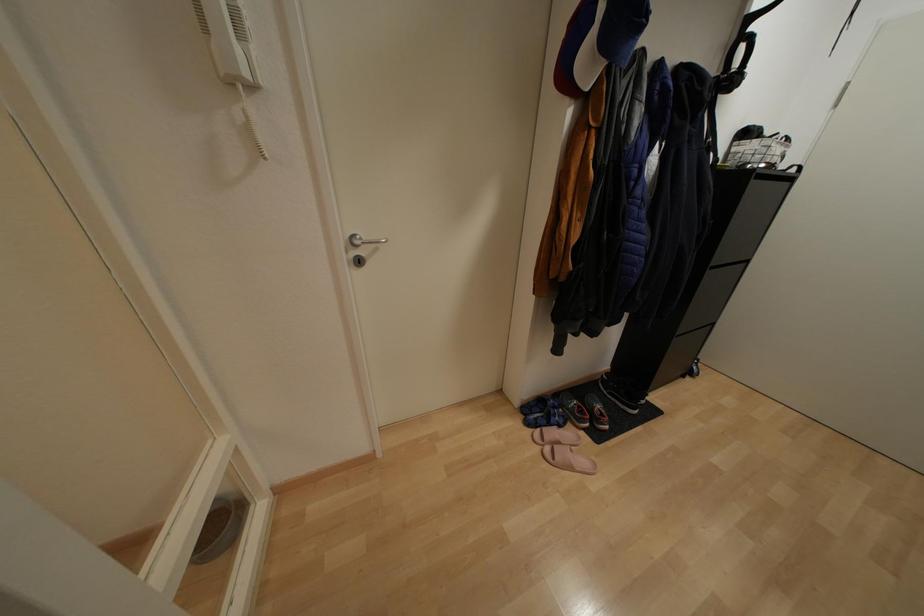
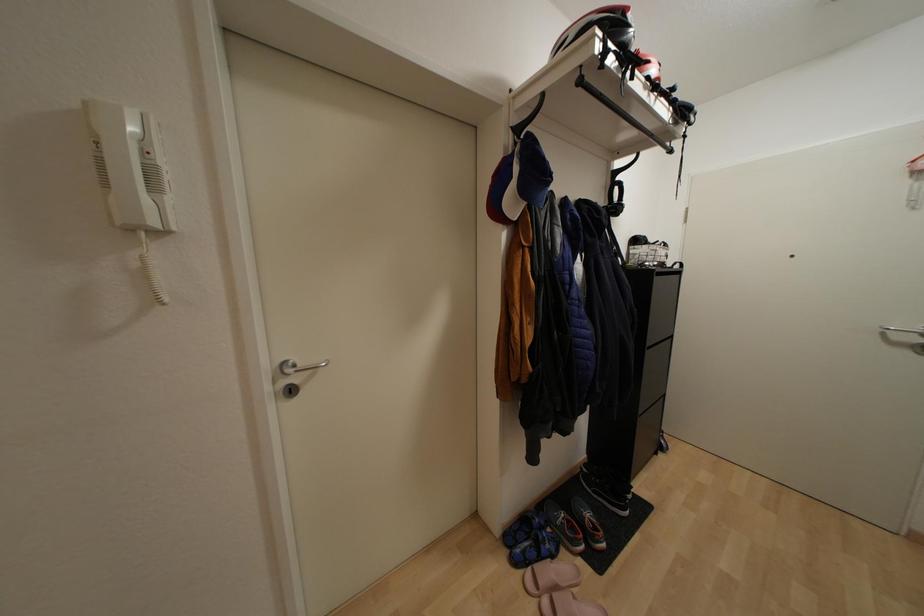
Question: What movement of the cameraman would produce the second image?

Choices:
 (A) Left
 (B) Right
 (C) Forward
 (D) Backward

Answer: (C)